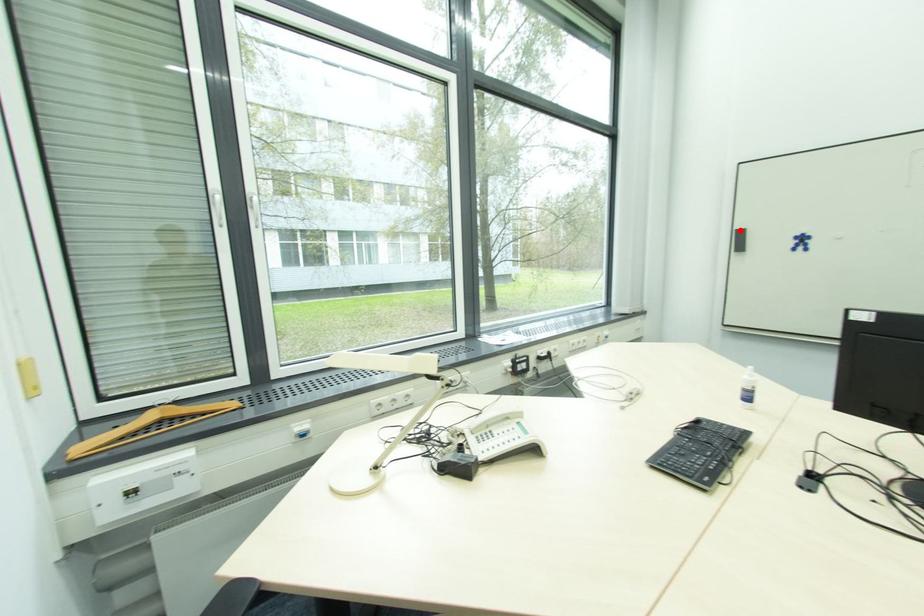
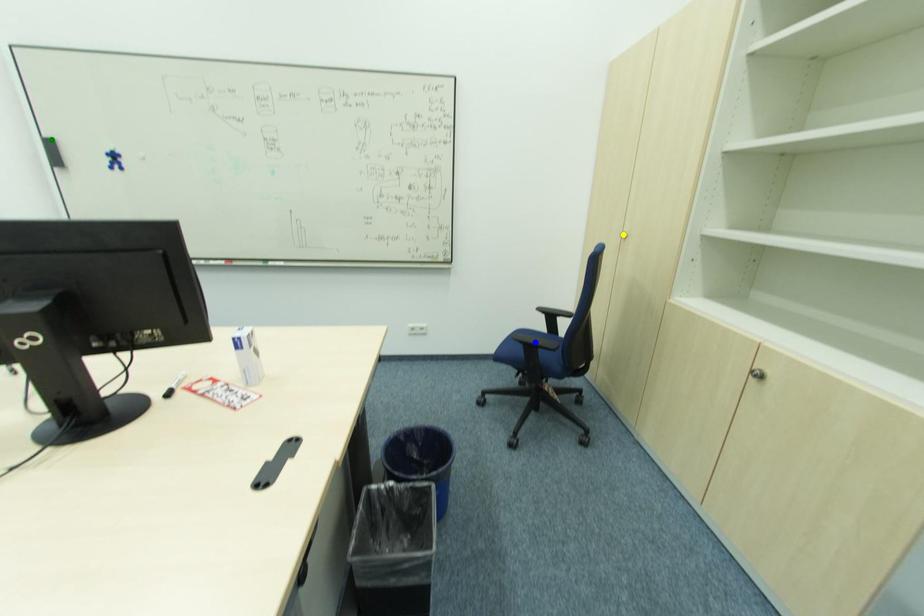
Question: I am providing you with two images of the same scene from different viewpoints. A red point is marked on the first image. You are given multiple points on the second image. Which mark in image 2 goes with the point in image 1?

Choices:
 (A) green point
 (B) blue point
 (C) yellow point

Answer: (A)